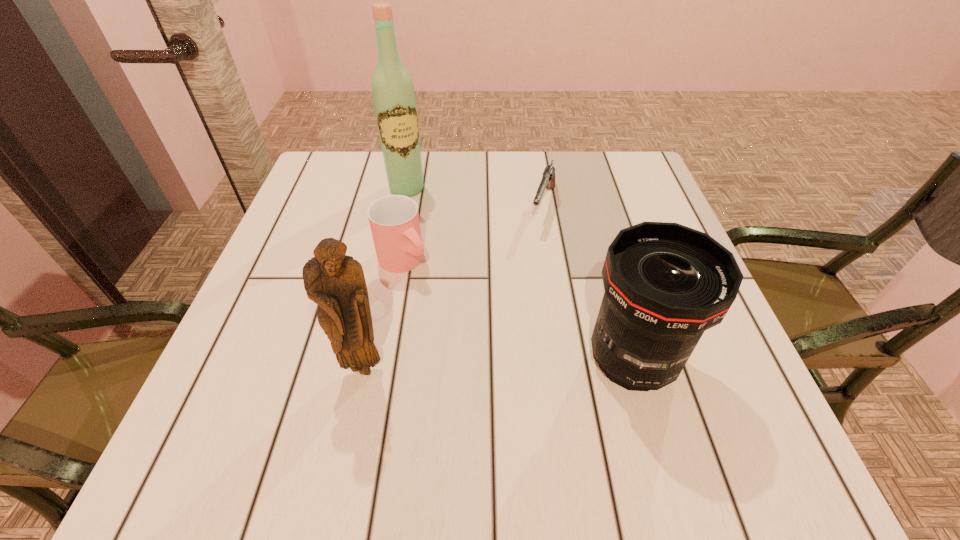
Locate an element on the screen. This screenshot has width=960, height=540. vacant area that lies between the figurine and the tallest object is located at coordinates (385, 278).

This screenshot has width=960, height=540. Find the location of `empty space that is in between the fourth shortest object and the gun`. empty space that is in between the fourth shortest object and the gun is located at coordinates (453, 287).

Image resolution: width=960 pixels, height=540 pixels. In order to click on free space between the tallest object and the gun in this screenshot , I will do `click(475, 197)`.

Find the location of `free space between the third tallest object and the fourth shortest object`. free space between the third tallest object and the fourth shortest object is located at coordinates (498, 364).

Where is `free spot between the third shortest object and the tallest object`? The height and width of the screenshot is (540, 960). free spot between the third shortest object and the tallest object is located at coordinates (519, 275).

Locate an element on the screen. vacant area that lies between the third nearest object and the figurine is located at coordinates (x=384, y=315).

At what (x,y) coordinates should I click in order to perform the action: click on free spot between the gun and the third nearest object. Please return your answer as a coordinate pair (x, y). Looking at the image, I should click on (473, 233).

You are a GUI agent. You are given a task and a screenshot of the screen. Output one action in this format:
    pyautogui.click(x=<x>, y=<y>)
    Task: Click on the vacant region between the tallest object and the third shortest object
    This screenshot has width=960, height=540.
    Given the screenshot: What is the action you would take?
    pyautogui.click(x=519, y=275)

At what (x,y) coordinates should I click in order to perform the action: click on object that is the third closest to the third nearest object. Please return your answer as a coordinate pair (x, y). The image size is (960, 540). Looking at the image, I should click on (548, 179).

Choose which object is the nearest neighbor to the second tallest object. Please provide its 2D coordinates. Your answer should be formatted as a tuple, i.e. [(x, y)], where the tuple contains the x and y coordinates of a point satisfying the conditions above.

[(394, 220)]